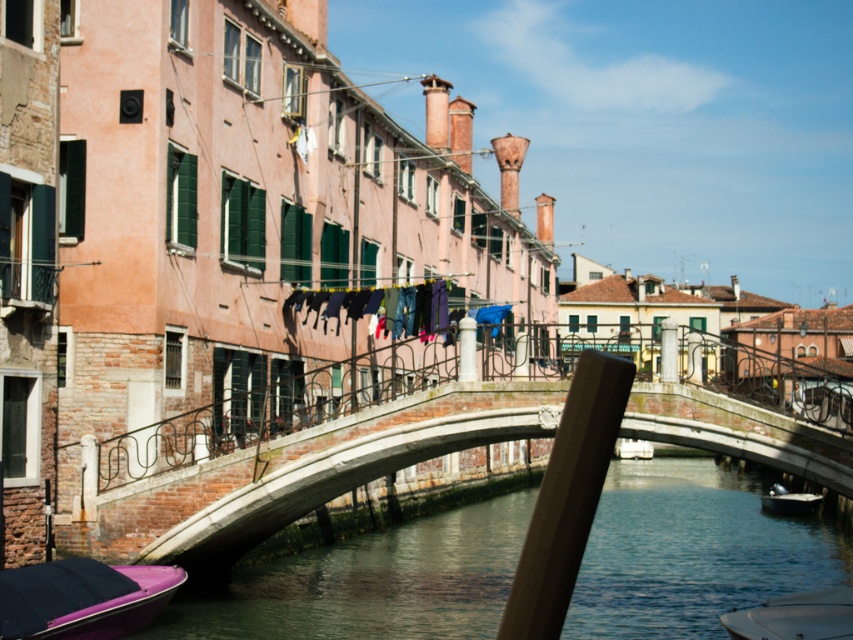
Question: Is brick stone bridge at center to the left of white plastic boat at lower right from the viewer's perspective?

Choices:
 (A) no
 (B) yes

Answer: (B)

Question: Is brick stone bridge at center in front of white plastic boat at center?

Choices:
 (A) yes
 (B) no

Answer: (A)

Question: Which of the following is the farthest from the observer?

Choices:
 (A) (651, 451)
 (B) (254, 532)
 (C) (848, 586)
 (D) (775, 486)

Answer: (A)

Question: Which of these objects is positioned closest to the clear water at bridge center?

Choices:
 (A) brick stone bridge at center
 (B) purple matte boat at lower left
 (C) white plastic boat at center

Answer: (A)

Question: Considering the real-world distances, which object is closest to the white plastic boat at center?

Choices:
 (A) metallic silver boat at lower right
 (B) white plastic boat at lower right
 (C) brick stone bridge at center

Answer: (C)

Question: Is purple matte boat at lower left smaller than metallic silver boat at lower right?

Choices:
 (A) yes
 (B) no

Answer: (B)